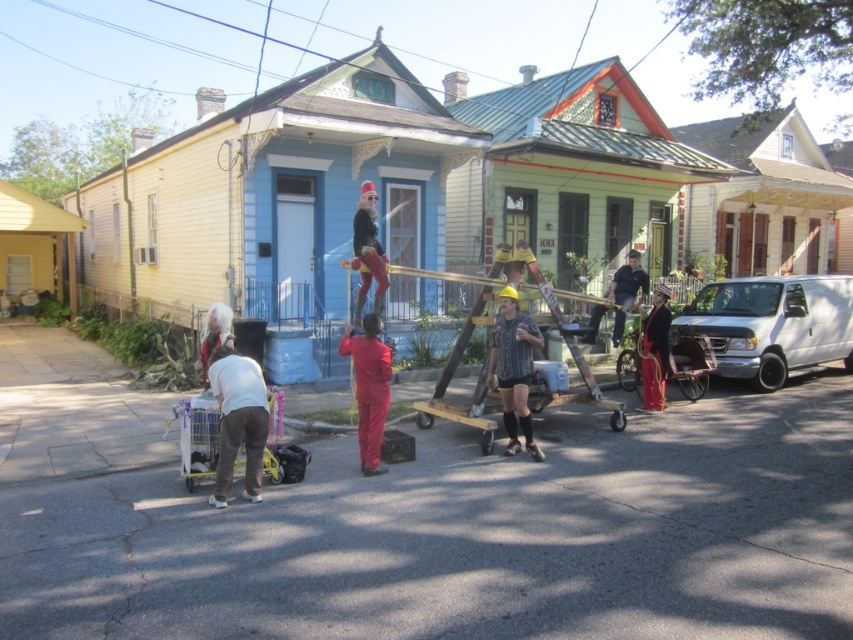
Question: Is wooden at center above dark blue jeans at center?

Choices:
 (A) yes
 (B) no

Answer: (B)

Question: Can you confirm if striped shirt at center is thinner than dark blue jeans at center?

Choices:
 (A) yes
 (B) no

Answer: (A)

Question: Which is farther from the wooden at center?

Choices:
 (A) dark blue jeans at center
 (B) striped shirt at center

Answer: (A)

Question: Based on their relative distances, which object is nearer to the wooden at center?

Choices:
 (A) striped shirt at center
 (B) dark blue jeans at center

Answer: (A)

Question: Which object is closer to the camera taking this photo?

Choices:
 (A) wooden at center
 (B) striped shirt at center
 (C) dark blue jeans at center

Answer: (B)

Question: Does wooden at center have a greater width compared to striped shirt at center?

Choices:
 (A) yes
 (B) no

Answer: (A)